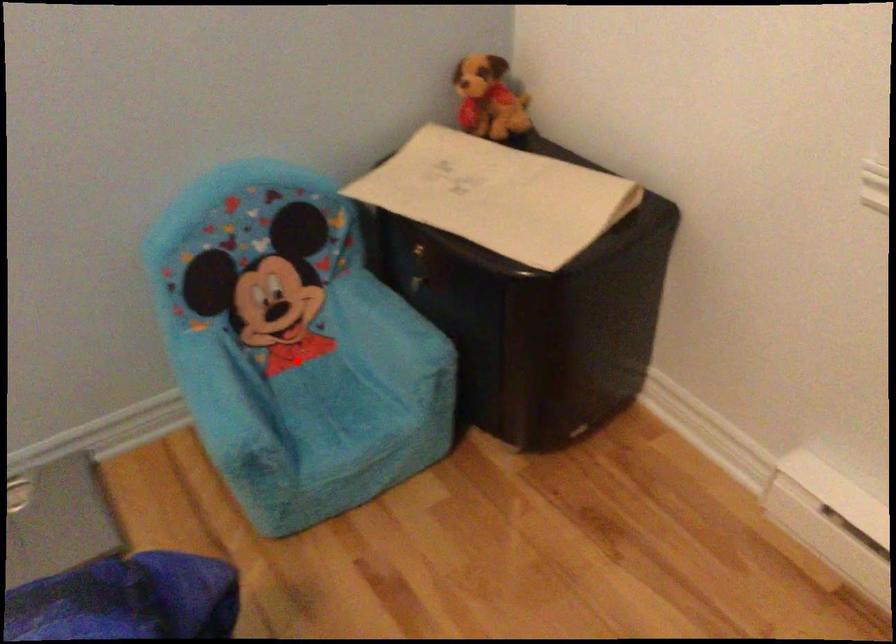
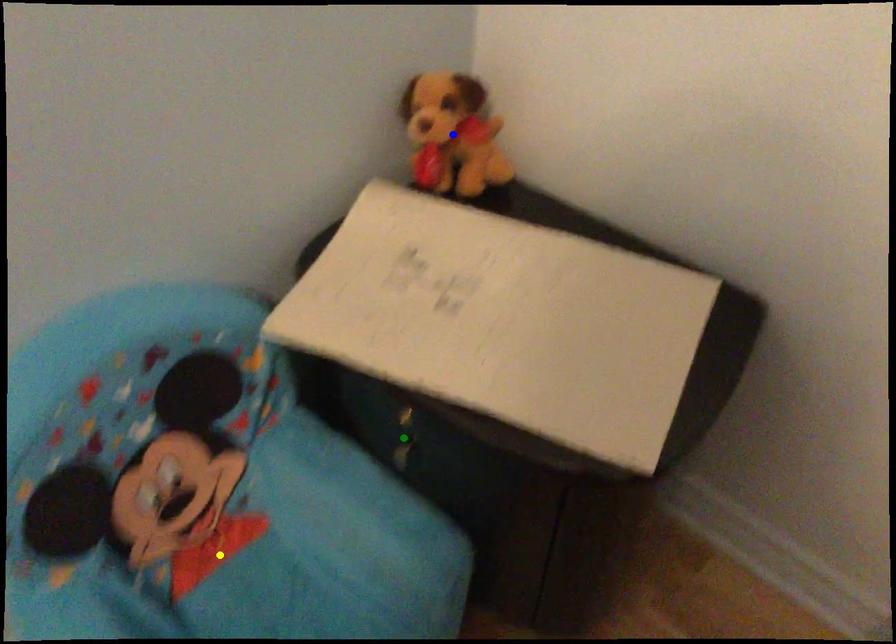
Question: I am providing you with two images of the same scene from different viewpoints. A red point is marked on the first image. You are given multiple points on the second image. In image 2, which mark is for the same physical point as the one in image 1?

Choices:
 (A) blue point
 (B) yellow point
 (C) green point

Answer: (B)